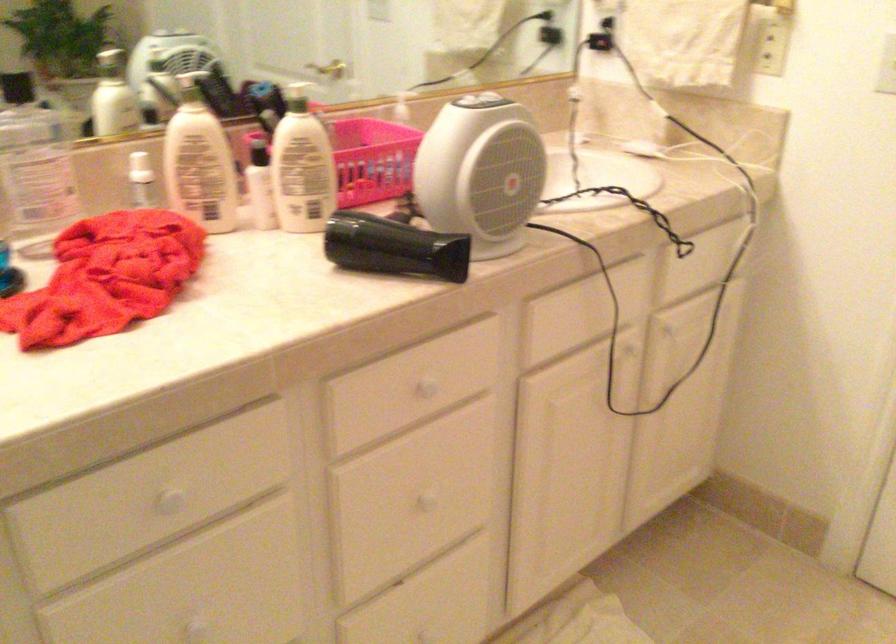
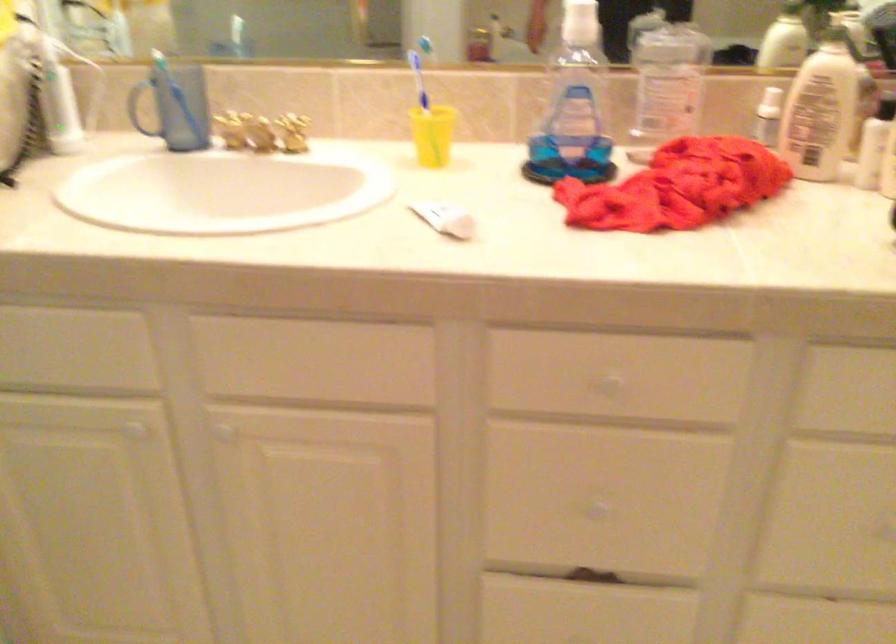
Locate, in the second image, the point that corresponds to the point at 161,500 in the first image.

(609, 384)